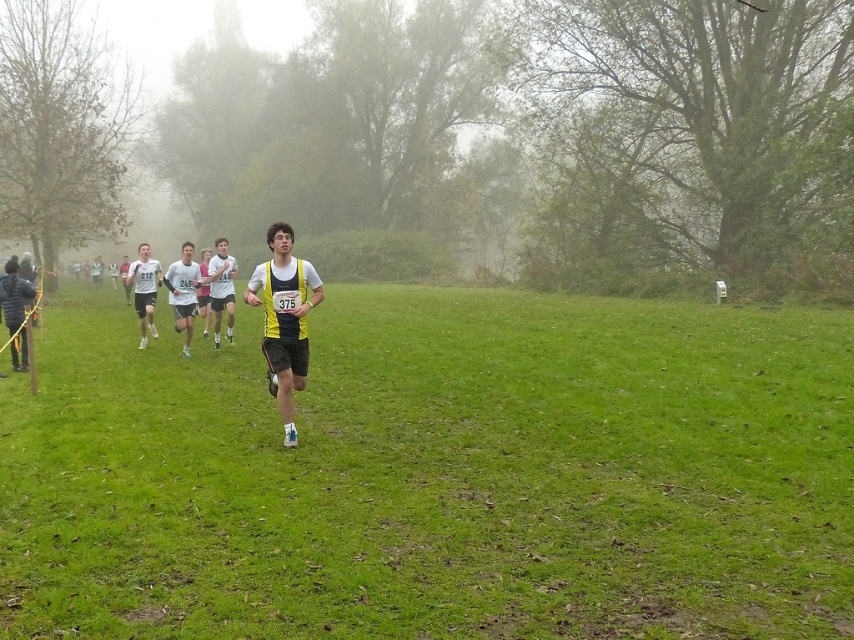
You are a photographer positioned at the camera location wanting to capture a close shot of the yellow fabric runner at center. Given that your camera can focus on subjects within 10 feet, will you be able to take a clear photo of the runner?

The yellow fabric runner at center is 11.64 feet away from the camera. Since the camera can only focus within 10 feet, the distance is too far to capture a clear photo.